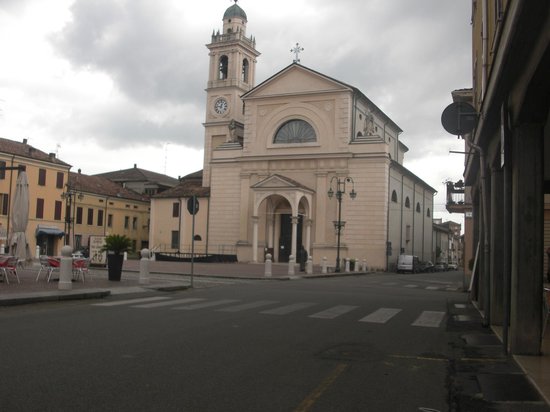
Image resolution: width=550 pixels, height=412 pixels. In order to click on table in this screenshot , I will do `click(49, 266)`, `click(4, 265)`.